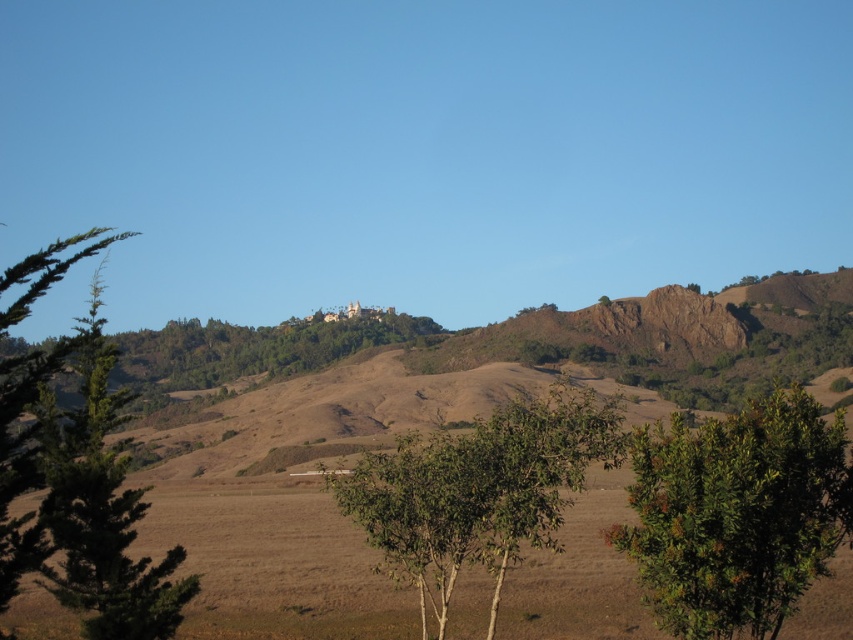
You are a photographer standing in the foreground of the landscape. You want to take a photo that includes both point A at point (811, 280) and point B at point (651, 500). Which point is closer to your camera?

Point B at point (651, 500) is closer to the camera because the description states that point A is further away than point B.